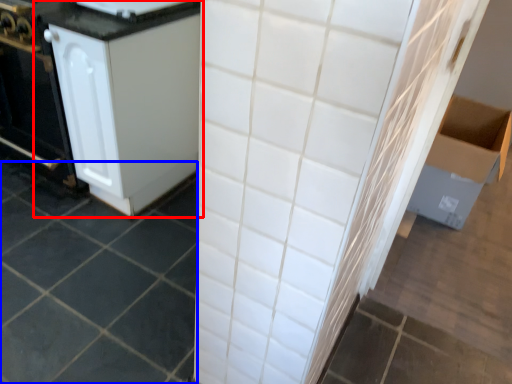
Question: Which object is closer to the camera taking this photo, cabinetry (highlighted by a red box) or ceramic tile (highlighted by a blue box)?

Choices:
 (A) cabinetry
 (B) ceramic tile

Answer: (B)